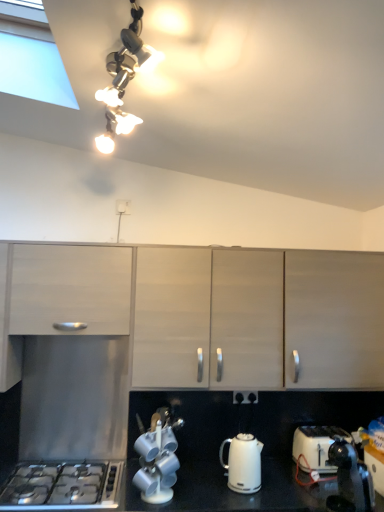
Question: Is white plastic toaster at lower right closer to camera compared to black plastic electric outlet at center, marked as the second electric outlet in a top-to-bottom arrangement?

Choices:
 (A) yes
 (B) no

Answer: (A)

Question: Is the position of white plastic toaster at lower right more distant than that of black plastic electric outlet at center, which appears as the 2th electric outlet when viewed from the left?

Choices:
 (A) yes
 (B) no

Answer: (B)

Question: From a real-world perspective, is white plastic toaster at lower right below black plastic electric outlet at center, the first electric outlet in the bottom-to-top sequence?

Choices:
 (A) no
 (B) yes

Answer: (B)

Question: Does white plastic toaster at lower right have a greater width compared to black plastic electric outlet at center, the first electric outlet in the bottom-to-top sequence?

Choices:
 (A) yes
 (B) no

Answer: (A)

Question: From the image's perspective, would you say white plastic toaster at lower right is shown under black plastic electric outlet at center, placed as the 1th electric outlet when sorted from right to left?

Choices:
 (A) no
 (B) yes

Answer: (B)

Question: Considering the relative sizes of white plastic toaster at lower right and black plastic electric outlet at center, the first electric outlet in the bottom-to-top sequence, in the image provided, is white plastic toaster at lower right thinner than black plastic electric outlet at center, the first electric outlet in the bottom-to-top sequence,?

Choices:
 (A) no
 (B) yes

Answer: (A)

Question: Can you confirm if metallic silver tea set at lower center is positioned to the right of white glossy electric kettle at lower center?

Choices:
 (A) no
 (B) yes

Answer: (A)

Question: Are metallic silver tea set at lower center and white glossy electric kettle at lower center located far from each other?

Choices:
 (A) no
 (B) yes

Answer: (A)

Question: Considering the relative positions of metallic silver tea set at lower center and white glossy electric kettle at lower center in the image provided, is metallic silver tea set at lower center to the left of white glossy electric kettle at lower center from the viewer's perspective?

Choices:
 (A) yes
 (B) no

Answer: (A)

Question: Are metallic silver tea set at lower center and white glossy electric kettle at lower center beside each other?

Choices:
 (A) yes
 (B) no

Answer: (B)

Question: From a real-world perspective, is metallic silver tea set at lower center positioned under white glossy electric kettle at lower center based on gravity?

Choices:
 (A) yes
 (B) no

Answer: (B)

Question: From the image's perspective, is metallic silver tea set at lower center below white glossy electric kettle at lower center?

Choices:
 (A) no
 (B) yes

Answer: (A)

Question: Does white glossy electric kettle at lower center lie behind matte wood cabinet at left, which is counted as the first cabinetry, starting from the left?

Choices:
 (A) yes
 (B) no

Answer: (B)